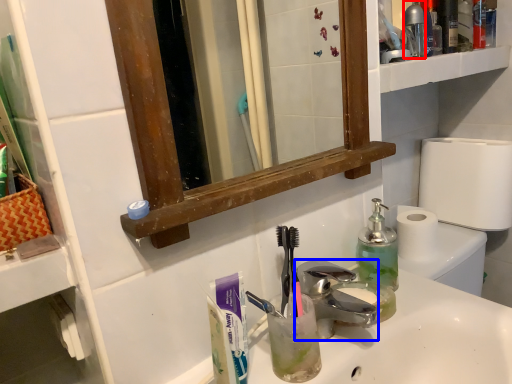
Question: Which object is further to the camera taking this photo, bottle (highlighted by a red box) or faucet (highlighted by a blue box)?

Choices:
 (A) bottle
 (B) faucet

Answer: (A)